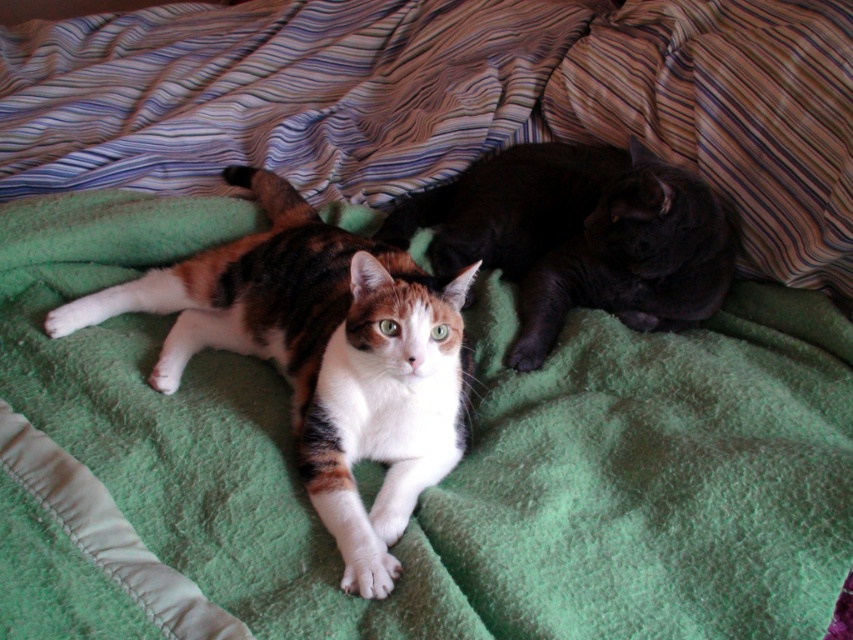
Is calico fur cat at center shorter than black glossy cat at upper right?

No.

Is point (422, 269) positioned after point (653, 244)?

Yes.

Locate an element on the screen. calico fur cat at center is located at coordinates [x=322, y=356].